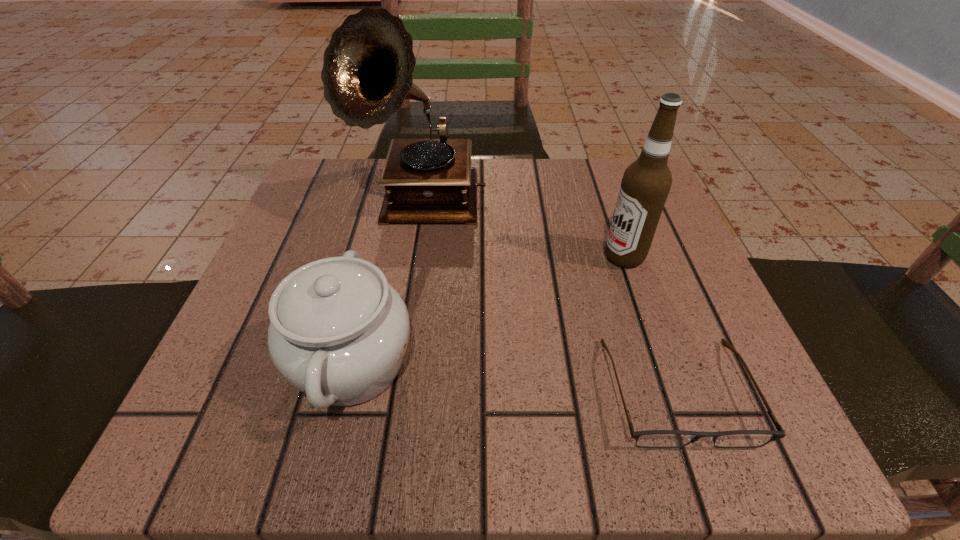
I want to click on vacant space situated on the right of the chinaware, so click(557, 362).

Locate an element on the screen. The height and width of the screenshot is (540, 960). object that is at the far edge is located at coordinates (368, 67).

Identify the location of chinaware positioned at the near edge. The image size is (960, 540). (338, 333).

Identify the location of spectacles that is at the near edge. This screenshot has height=540, width=960. (651, 438).

Identify the location of record player that is at the left edge. The height and width of the screenshot is (540, 960). (368, 67).

At what (x,y) coordinates should I click in order to perform the action: click on chinaware at the left edge. Please return your answer as a coordinate pair (x, y). This screenshot has width=960, height=540. Looking at the image, I should click on (338, 333).

Locate an element on the screen. alcohol positioned at the right edge is located at coordinates (646, 183).

This screenshot has height=540, width=960. In order to click on spectacles present at the right edge in this screenshot , I will do `click(651, 438)`.

Find the location of `object present at the far left corner`. object present at the far left corner is located at coordinates (368, 67).

Locate an element on the screen. The width and height of the screenshot is (960, 540). object at the near left corner is located at coordinates (338, 333).